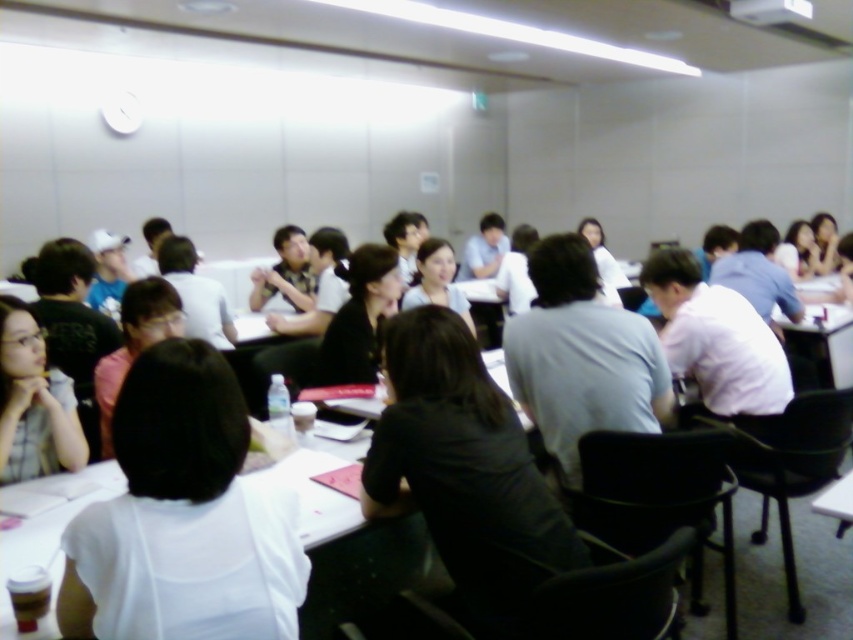
Question: Which of the following is the farthest from the observer?

Choices:
 (A) white paper at center
 (B) matte black glasses at lower left
 (C) black matte shirt at center
 (D) black shirt at center

Answer: (D)

Question: Can you confirm if white paper at center is positioned above black matte shirt at center?

Choices:
 (A) no
 (B) yes

Answer: (A)

Question: Which of the following is the farthest from the observer?

Choices:
 (A) black shirt at center
 (B) white paper at center
 (C) black matte shirt at center
 (D) matte black glasses at lower left

Answer: (A)

Question: Does white paper at center appear on the left side of matte black glasses at lower left?

Choices:
 (A) yes
 (B) no

Answer: (B)

Question: Can you confirm if white paper at center is positioned to the right of matte black glasses at lower left?

Choices:
 (A) no
 (B) yes

Answer: (B)

Question: Estimate the real-world distances between objects in this image. Which object is farther from the black shirt at center?

Choices:
 (A) white paper at center
 (B) matte black glasses at lower left
 (C) black matte shirt at center

Answer: (A)